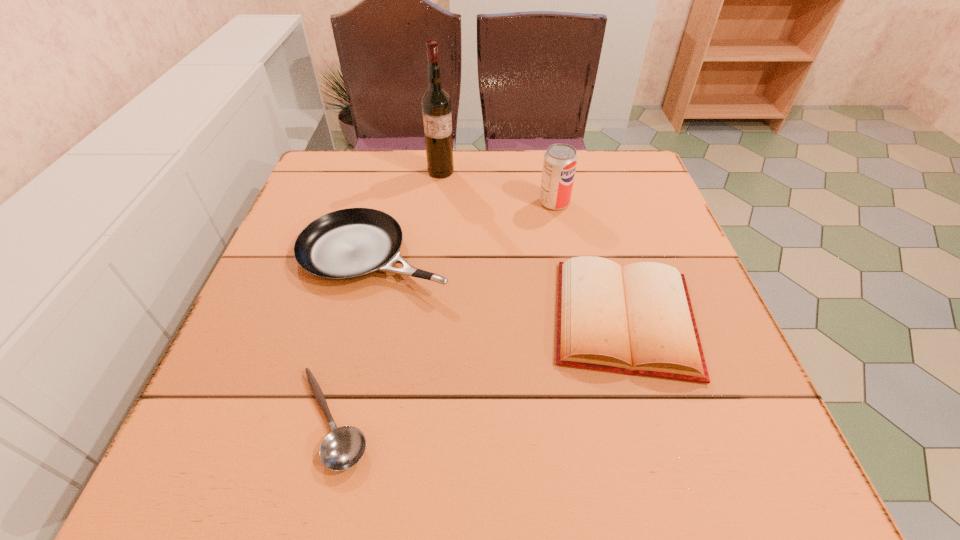
Identify the location of wine bottle. Image resolution: width=960 pixels, height=540 pixels. (436, 105).

Identify the location of the tallest object. The height and width of the screenshot is (540, 960). (436, 105).

Where is `soda`? soda is located at coordinates (560, 160).

Locate an element on the screen. This screenshot has width=960, height=540. the second tallest object is located at coordinates (560, 160).

Identify the location of the third tallest object. (347, 244).

I want to click on Bible, so click(x=638, y=320).

Where is `the shortest object`? Image resolution: width=960 pixels, height=540 pixels. the shortest object is located at coordinates (343, 447).

Image resolution: width=960 pixels, height=540 pixels. Identify the location of vacant region located 0.280m on the front and back of the farthest object. (432, 252).

What are the coordinates of `free spot located on the left of the fourth nearest object` in the screenshot? It's located at (425, 202).

Where is `blank area located on the front of the pan`? This screenshot has height=540, width=960. blank area located on the front of the pan is located at coordinates (336, 415).